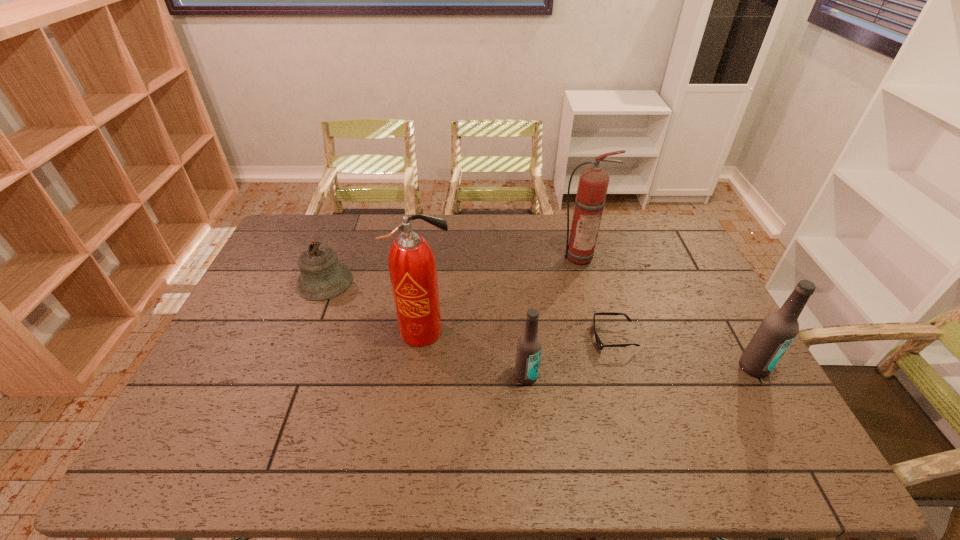
In order to click on free space between the sunglasses and the left fire extinguisher in this screenshot , I will do `click(518, 334)`.

The width and height of the screenshot is (960, 540). Find the location of `free spot between the farther fire extinguisher and the second object from left to right`. free spot between the farther fire extinguisher and the second object from left to right is located at coordinates (501, 293).

In order to click on vacant region between the right beer bottle and the sunglasses in this screenshot , I will do `click(684, 352)`.

This screenshot has height=540, width=960. What are the coordinates of `vacant space that is in between the farther fire extinguisher and the third shortest object` in the screenshot? It's located at (553, 316).

Select which object appears as the third closest to the right beer bottle. Please provide its 2D coordinates. Your answer should be formatted as a tuple, i.e. [(x, y)], where the tuple contains the x and y coordinates of a point satisfying the conditions above.

[(529, 345)]

Identify the location of object that is the fifth closest one to the shortest object. The image size is (960, 540). (322, 277).

Identify the location of vacant space that satisfies the following two spatial constraints: 1. on the front-facing side of the shortest object; 2. on the side of the fourth object from right to left with the label. The height and width of the screenshot is (540, 960). (624, 376).

Locate an element on the screen. This screenshot has height=540, width=960. free space in the image that satisfies the following two spatial constraints: 1. on the front side of the leftmost object; 2. on the left side of the second object from left to right is located at coordinates (305, 331).